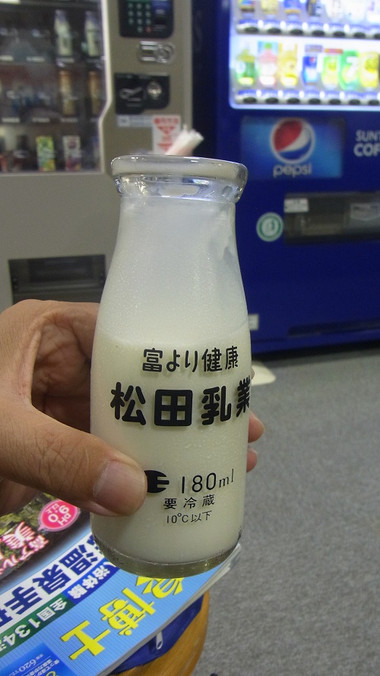
Locate an element on the screen. The image size is (380, 676). part of the vending machine where you grab your product out of is located at coordinates (63, 270), (346, 217).